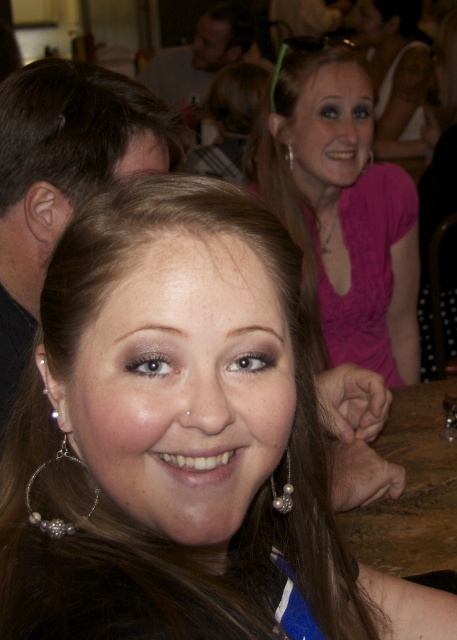
You are a photographer at the event and want to capture a photo that includes both the shiny silver hoop earrings at center and the matte pink blouse at upper center. Which object should you adjust your camera focus to first to ensure both are in the frame?

The shiny silver hoop earrings at center is closer to the viewer than the matte pink blouse at upper center, so you should focus on the shiny silver hoop earrings at center first to ensure both are in the frame.

You are a photographer at the event and want to ensure both the pink satin blouse at upper center and the dark brown hair at upper left are clearly visible in your photo. Considering their sizes, which one might you need to adjust your camera focus on to capture more detail?

The pink satin blouse at upper center is larger than the dark brown hair at upper left, so you should focus on the pink satin blouse at upper center to capture more detail as it occupies a bigger area in the frame.